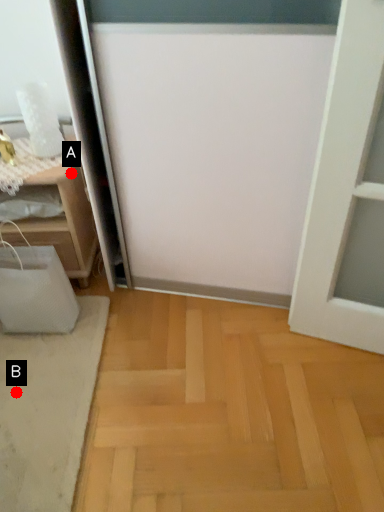
Question: Two points are circled on the image, labeled by A and B beside each circle. Among these points, which one is farthest from the camera?

Choices:
 (A) A is further
 (B) B is further

Answer: (A)